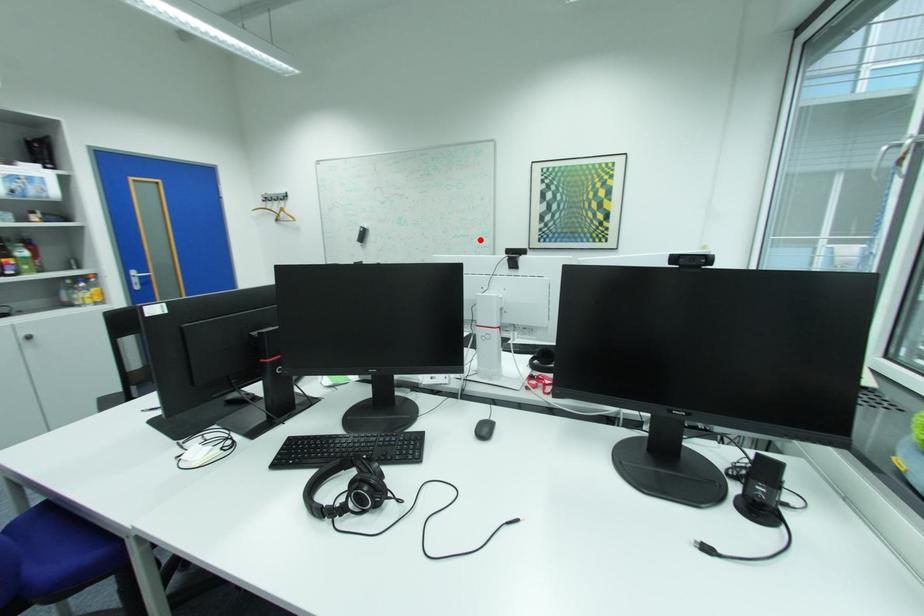
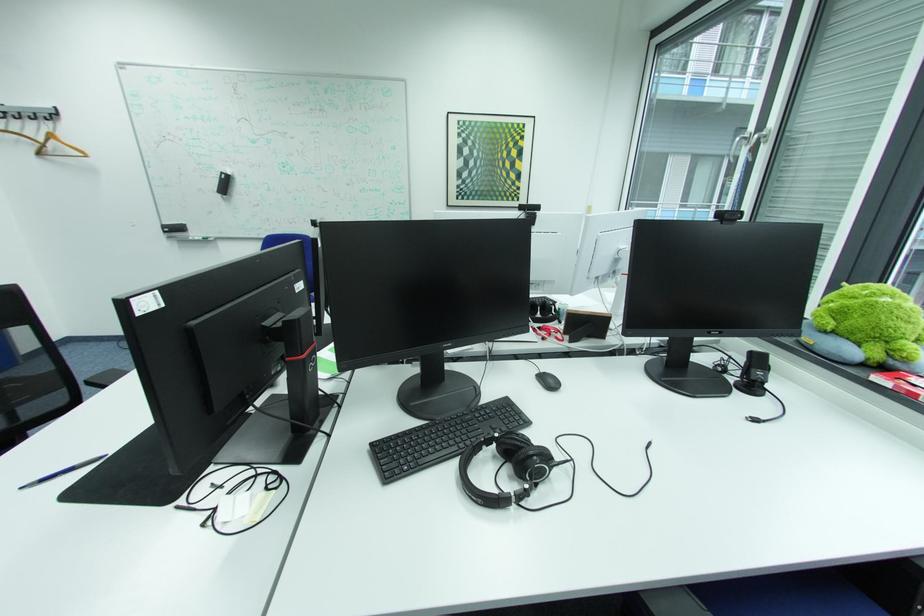
The point at the highlighted location is marked in the first image. Where is the corresponding point in the second image?

(393, 195)